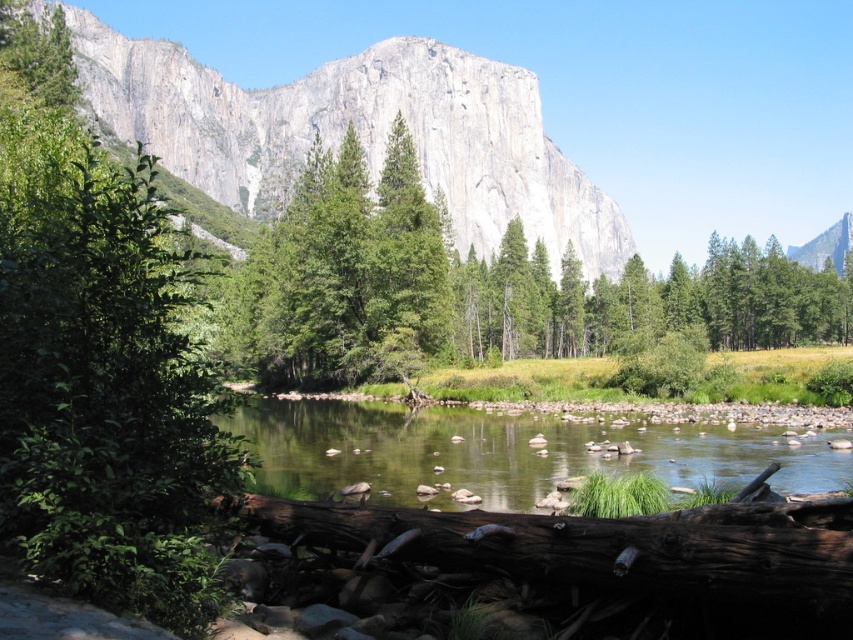
Is gray rock mountain at upper center to the left of green matte tree at center from the viewer's perspective?

Yes, gray rock mountain at upper center is to the left of green matte tree at center.

Who is higher up, gray rock mountain at upper center or green matte tree at center?

gray rock mountain at upper center is above.

Between point (444, 160) and point (376, 310), which one is positioned behind?

The point (444, 160) is behind.

Identify the location of gray rock mountain at upper center. (358, 132).

Is point (131, 83) positioned behind point (364, 433)?

Yes, it is.

Consider the image. Does gray rock mountain at upper center have a lesser height compared to clear water at center?

Incorrect, gray rock mountain at upper center's height does not fall short of clear water at center's.

Is point (231, 129) positioned before point (637, 438)?

No, it is not.

You are a GUI agent. You are given a task and a screenshot of the screen. Output one action in this format:
    pyautogui.click(x=<x>, y=<y>)
    Task: Click on the gray rock mountain at upper center
    The height and width of the screenshot is (640, 853).
    Given the screenshot: What is the action you would take?
    [358, 132]

Does green leafy tree at left have a lesser width compared to clear water at center?

Incorrect, green leafy tree at left's width is not less than clear water at center's.

Based on the photo, which is more to the left, green leafy tree at left or clear water at center?

green leafy tree at left is more to the left.

Does point (73, 160) come closer to viewer compared to point (834, 452)?

No, it is not.

At what (x,y) coordinates should I click in order to perform the action: click on green leafy tree at left. Please return your answer as a coordinate pair (x, y). The width and height of the screenshot is (853, 640). Looking at the image, I should click on (100, 360).